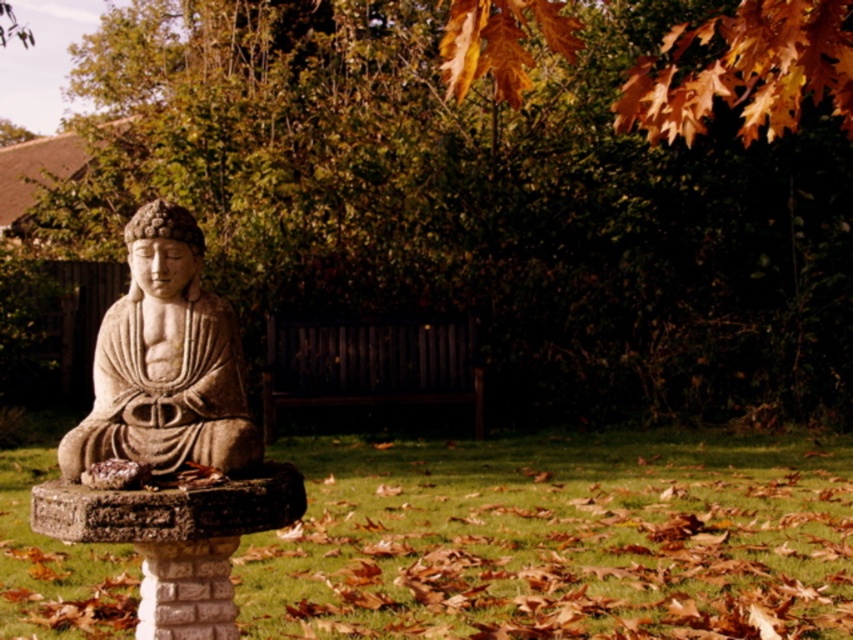
You are standing in the garden looking at the statue. There are two points marked in the scene. Which point is closer to you, point (509,358) or point (323,403)?

Point (509,358) is further to the viewer than point (323,403), so point (323,403) is closer to you.

You are a gardener who wants to place a new decorative pot between the autumn leaves at upper center and the stone statue at center. Which object should you position the pot closer to so that it doesn

The autumn leaves at upper center is taller than the stone statue at center. Therefore, to place the decorative pot between them at a safe distance from the taller leaves, you should position it closer to the stone statue at center.